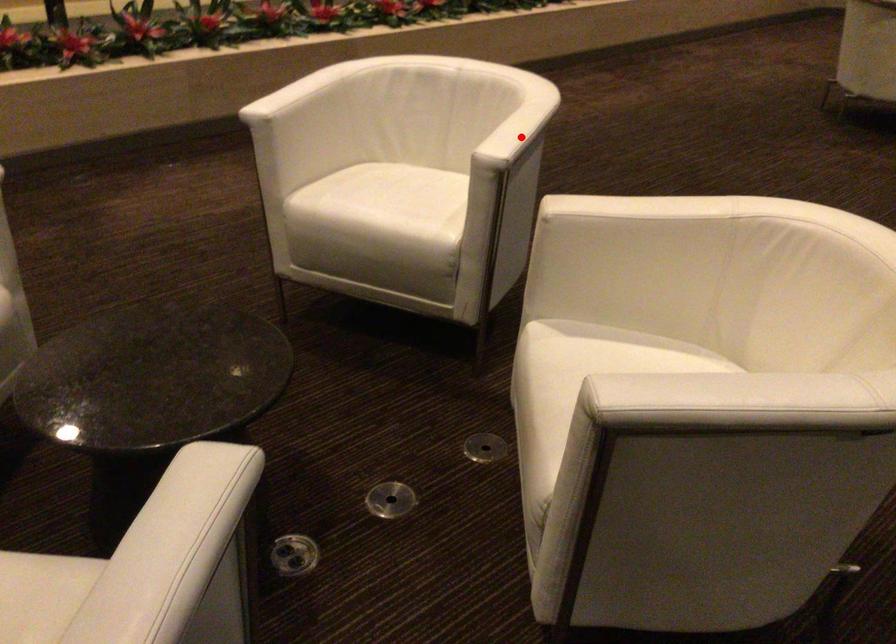
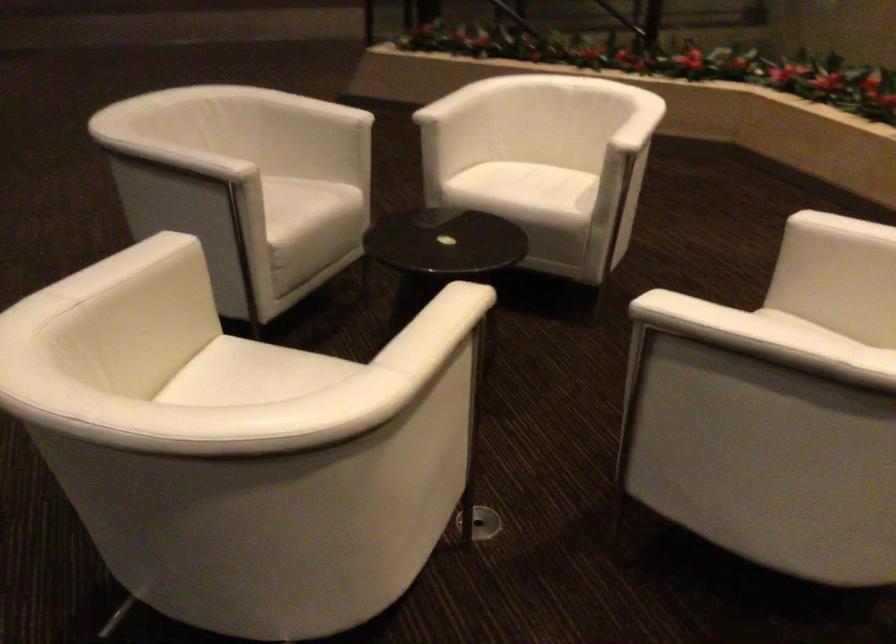
Question: I am providing you with two images of the same scene from different viewpoints. Given a red point in image1, look at the same physical point in image2. Is it:

Choices:
 (A) Closer to the viewpoint
 (B) Farther from the viewpoint

Answer: (A)